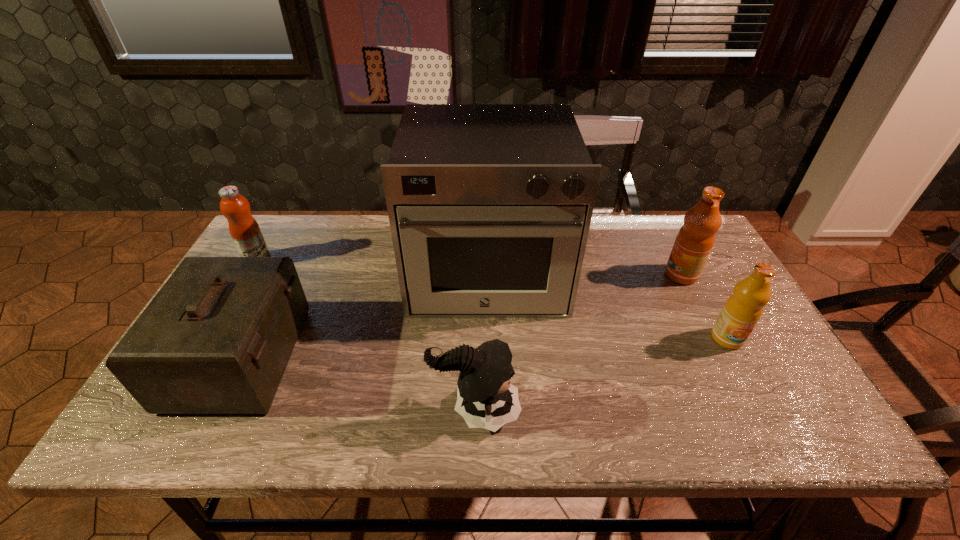
Locate an element on the screen. toaster oven positioned at the far edge is located at coordinates (490, 205).

Identify the location of fruit juice present at the far edge. (244, 229).

In order to click on the first-aid kit that is at the near edge in this screenshot , I will do `click(216, 339)`.

The width and height of the screenshot is (960, 540). What are the coordinates of `doll positioned at the near edge` in the screenshot? It's located at (485, 398).

The width and height of the screenshot is (960, 540). In order to click on fruit juice at the left edge in this screenshot , I will do `click(244, 229)`.

Where is `the first-aid kit that is at the left edge`? The image size is (960, 540). the first-aid kit that is at the left edge is located at coordinates (216, 339).

You are a GUI agent. You are given a task and a screenshot of the screen. Output one action in this format:
    pyautogui.click(x=<x>, y=<y>)
    Task: Click on the object that is at the far left corner
    This screenshot has height=540, width=960.
    Given the screenshot: What is the action you would take?
    pyautogui.click(x=244, y=229)

Find the location of a particular element. The width and height of the screenshot is (960, 540). object present at the near left corner is located at coordinates (216, 339).

In order to click on vacant region at the far edge in this screenshot , I will do `click(617, 248)`.

In the image, there is a desktop. In order to click on vacant space at the near edge in this screenshot , I will do `click(660, 434)`.